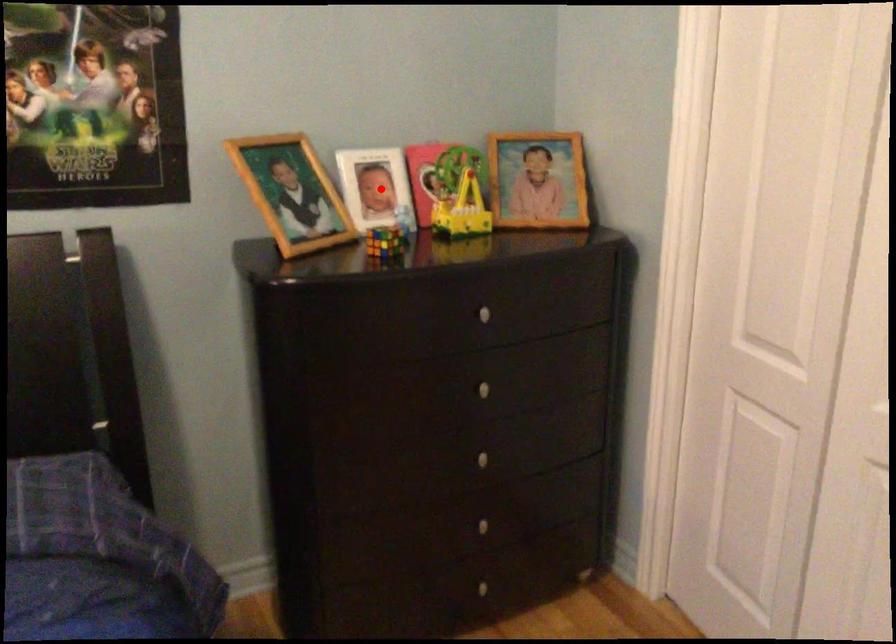
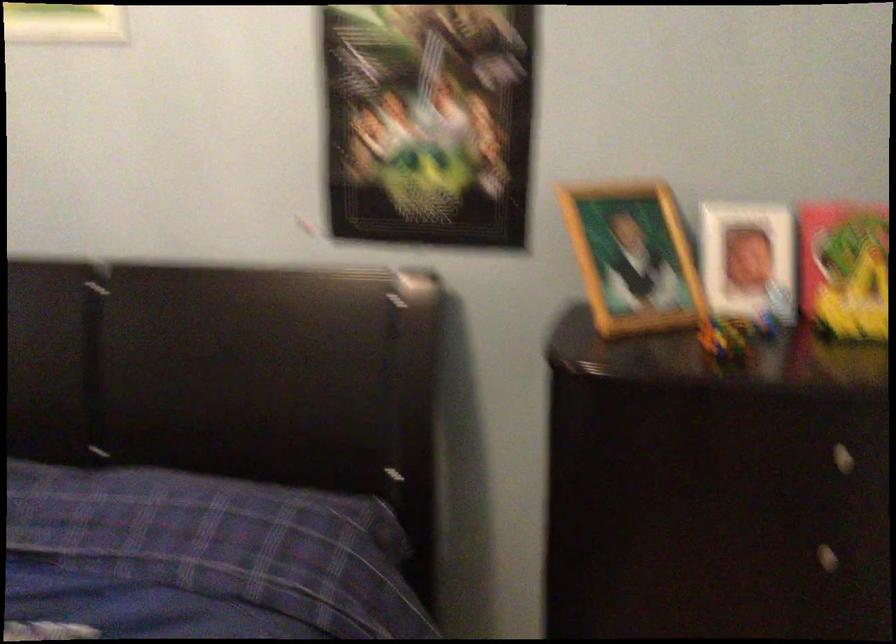
Question: A red point is marked in image1. In image2, is the corresponding 3D point closer to the camera or farther? Reply with the corresponding letter.

Choices:
 (A) The corresponding 3D point is closer.
 (B) The corresponding 3D point is farther.

Answer: (A)